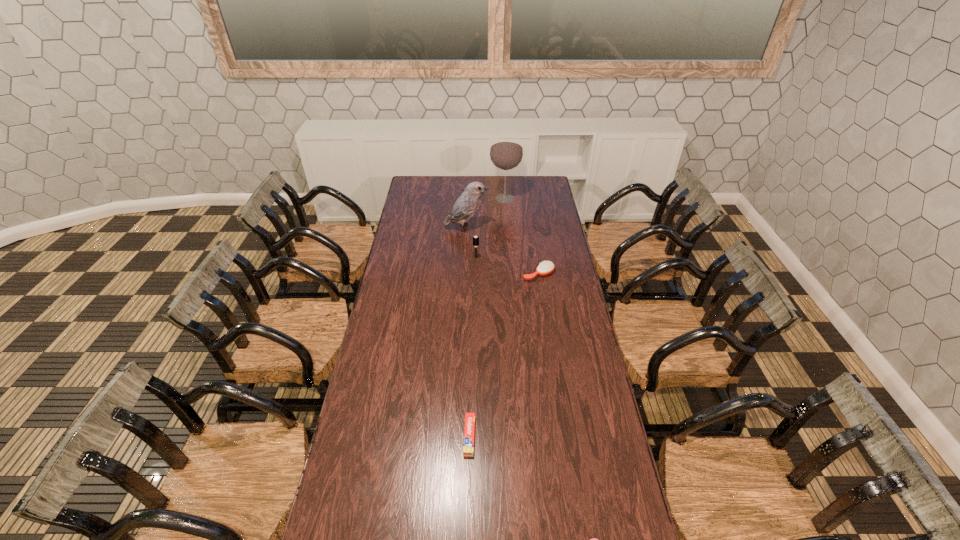
Image resolution: width=960 pixels, height=540 pixels. I want to click on the farthest object, so click(506, 153).

This screenshot has width=960, height=540. I want to click on the tallest object, so click(506, 153).

You are a GUI agent. You are given a task and a screenshot of the screen. Output one action in this format:
    pyautogui.click(x=<x>, y=<y>)
    Task: Click on the second farthest object
    This screenshot has height=540, width=960.
    Given the screenshot: What is the action you would take?
    pyautogui.click(x=467, y=204)

Locate an element on the screen. This screenshot has height=540, width=960. the second tallest object is located at coordinates (467, 204).

Image resolution: width=960 pixels, height=540 pixels. Find the location of `the farthest hairbrush`. the farthest hairbrush is located at coordinates (475, 238).

You are a GUI agent. You are given a task and a screenshot of the screen. Output one action in this format:
    pyautogui.click(x=<x>, y=<y>)
    Task: Click on the third farthest object
    The image size is (960, 540).
    Given the screenshot: What is the action you would take?
    pyautogui.click(x=475, y=238)

Find the location of `the third shortest object`. the third shortest object is located at coordinates (546, 267).

Locate an element on the screen. the second farthest hairbrush is located at coordinates tap(546, 267).

Locate an element on the screen. The image size is (960, 540). the second nearest object is located at coordinates (468, 447).

Find the location of `the fifth tallest object`. the fifth tallest object is located at coordinates (468, 447).